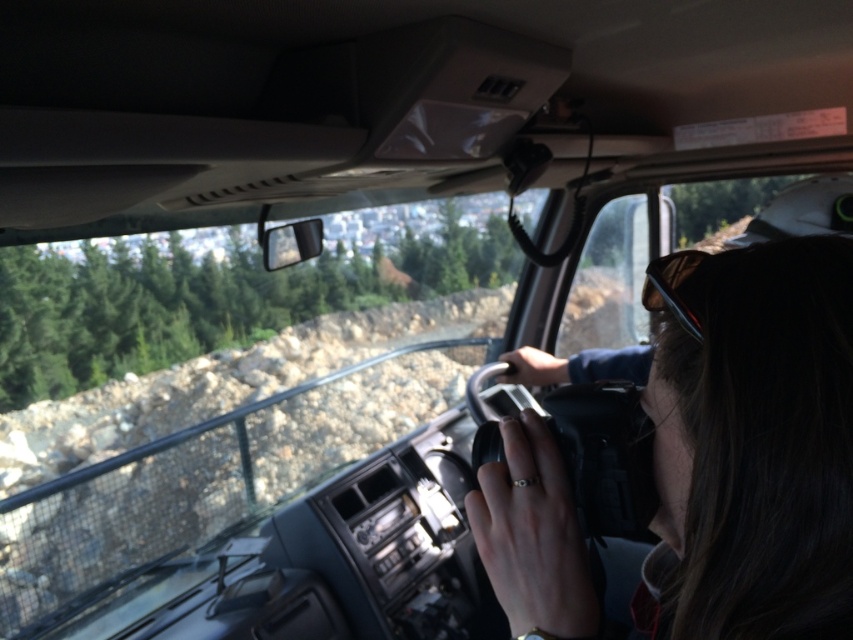
Question: In this image, where is matte black camera at center located relative to sunglasses at center?

Choices:
 (A) below
 (B) above

Answer: (A)

Question: Does matte black camera at center have a smaller size compared to sunglasses at center?

Choices:
 (A) no
 (B) yes

Answer: (A)

Question: Does matte black camera at center have a smaller size compared to sunglasses at center?

Choices:
 (A) no
 (B) yes

Answer: (A)